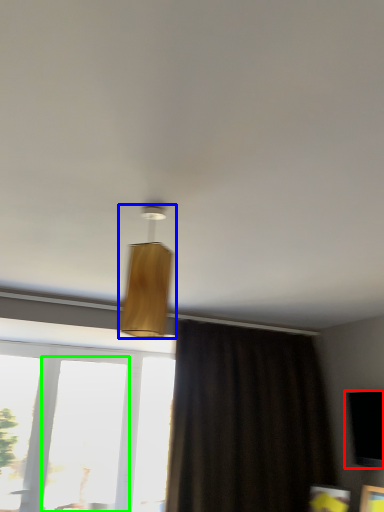
Question: Which object is the closest to the window screen (highlighted by a red box)? Choose among these: lamp (highlighted by a blue box) or window (highlighted by a green box).

Choices:
 (A) lamp
 (B) window

Answer: (A)